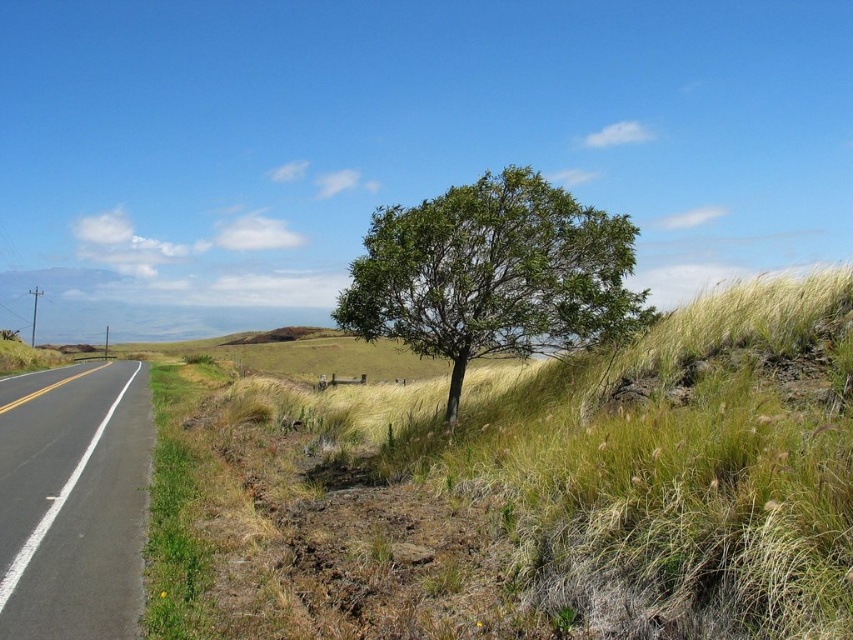
Describe the element at coordinates (492, 275) in the screenshot. I see `green leafy tree at center` at that location.

Is point (495, 333) positioned after point (108, 480)?

No, it is in front of (108, 480).

At what (x,y) coordinates should I click in order to perform the action: click on green leafy tree at center. Please return your answer as a coordinate pair (x, y). This screenshot has width=853, height=640. Looking at the image, I should click on (492, 275).